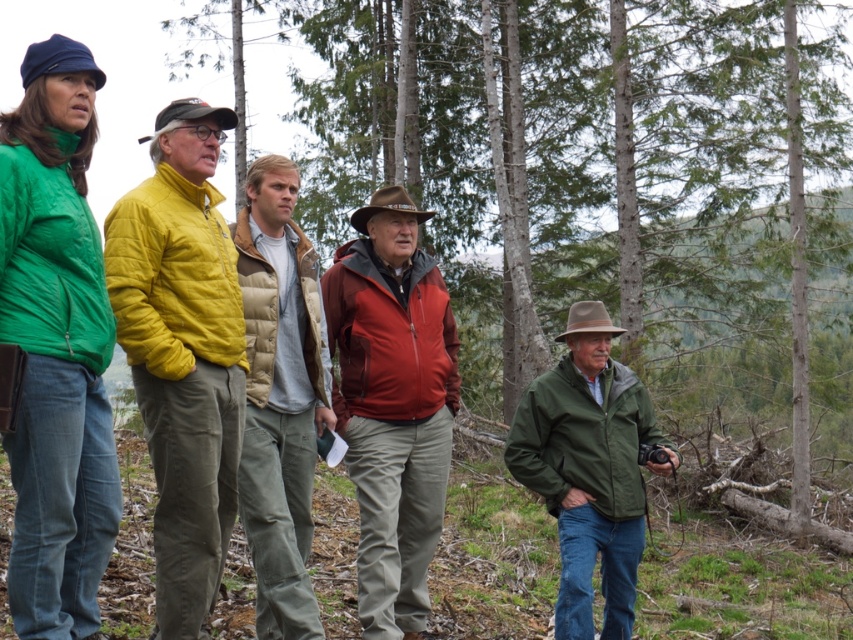
Does matte green jacket at left lie in front of matte red jacket at center?

That is True.

Does matte green jacket at left appear on the left side of matte red jacket at center?

Indeed, matte green jacket at left is positioned on the left side of matte red jacket at center.

Does point (50, 538) lie behind point (410, 628)?

No, it is not.

At what (x,y) coordinates should I click in order to perform the action: click on matte green jacket at left. Please return your answer as a coordinate pair (x, y). Looking at the image, I should click on (56, 348).

Who is taller, khaki cotton pants at center or green matte jacket at center?

With more height is khaki cotton pants at center.

Which is above, khaki cotton pants at center or green matte jacket at center?

khaki cotton pants at center is above.

Which is behind, point (262, 275) or point (558, 618)?

Positioned behind is point (558, 618).

Where is `khaki cotton pants at center`? The image size is (853, 640). khaki cotton pants at center is located at coordinates (280, 397).

Who is taller, matte green jacket at left or khaki cotton pants at center?

With more height is khaki cotton pants at center.

Based on the photo, does matte green jacket at left appear over khaki cotton pants at center?

Correct, matte green jacket at left is located above khaki cotton pants at center.

Who is more forward, (45, 593) or (280, 260)?

Point (45, 593) is in front.

The height and width of the screenshot is (640, 853). In order to click on matte green jacket at left in this screenshot , I will do `click(56, 348)`.